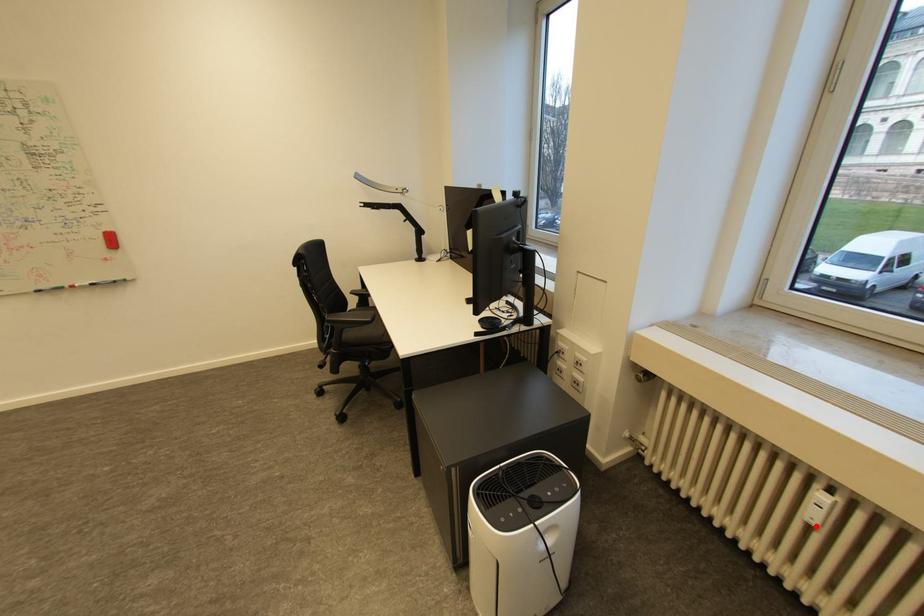
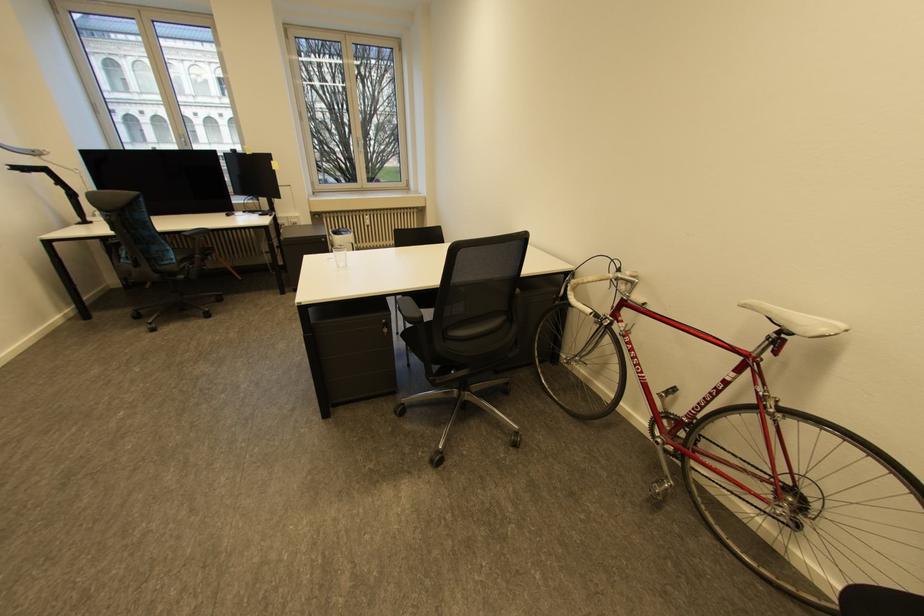
The point at the highlighted location is marked in the first image. Where is the corresponding point in the second image?

(374, 227)